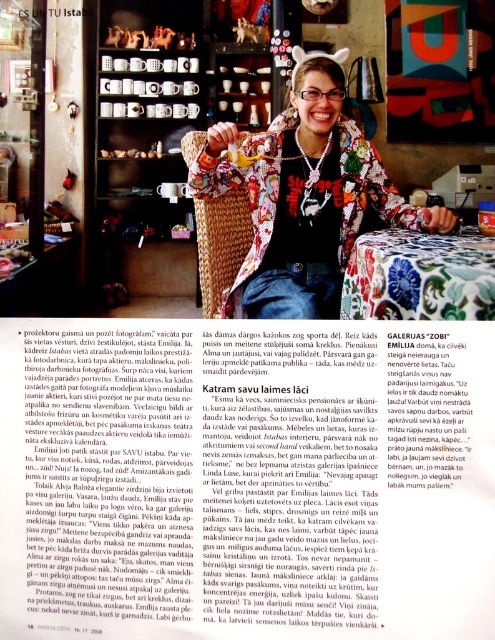
You are designing a layout for a magazine cover. You have a blacktextured fabricmagazine at center. Where should you place it to ensure it is centered both horizontally and vertically? Please provide coordinates in the format of x,y where x is between 0 and 1 and y is between 0 and 1.

The blacktextured fabricmagazine at center should be placed at coordinates (247, 477) to ensure it is centered both horizontally and vertically according to the provided coordinates.

Consider the image. You are a photographer setting up a shoot in this cozy, eclectic shop. You have a floral fabric jacket at center and a smooth brown bread at center in the scene. Which object should you adjust to ensure both fit within the frame without cropping? Explain your reasoning.

The floral fabric jacket at center has a larger width than the smooth brown bread at center. To ensure both fit within the frame without cropping, you should adjust the position of the floral fabric jacket at center since it requires more space due to its greater width.

You are a photographer trying to capture the floral fabric jacket at center and the smooth brown bread at center in the same frame. Since both are at the center, how can you adjust your camera angle to ensure both are visible without one blocking the other?

The floral fabric jacket at center is in front of the smooth brown bread at center. To capture both in the same frame, move the camera slightly to the side so that the jacket and bread are not directly overlapping, allowing the bread to be visible behind the jacket.